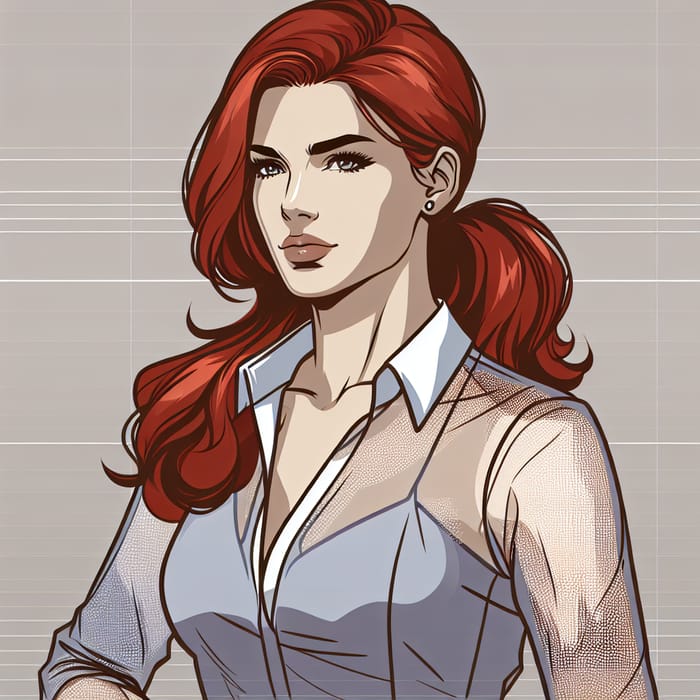
Image resolution: width=700 pixels, height=700 pixels. Find the location of `wall`. wall is located at coordinates (41, 367).